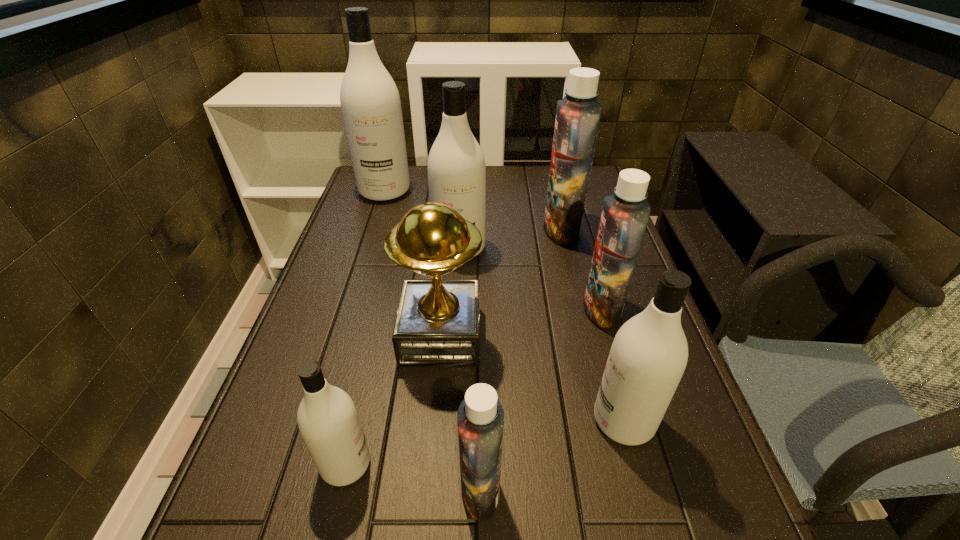
You are a GUI agent. You are given a task and a screenshot of the screen. Output one action in this format:
    pyautogui.click(x=<x>, y=<y>)
    Task: Click on the vacant space at the left edge of the desktop
    
    Given the screenshot: What is the action you would take?
    pyautogui.click(x=266, y=513)

Where is `free location at the right edge`? The image size is (960, 540). free location at the right edge is located at coordinates (660, 538).

Locate an element on the screen. vacant space at the far left corner of the desktop is located at coordinates [354, 197].

Locate an element on the screen. vacant space at the far right corner of the desktop is located at coordinates (590, 190).

Locate an element on the screen. free space between the nearest blue shampoo and the third nearest white shampoo is located at coordinates (470, 369).

This screenshot has height=540, width=960. Identify the location of free space between the second farthest blue shampoo and the farthest shampoo. (493, 250).

Locate an element on the screen. Image resolution: width=960 pixels, height=540 pixels. vacant area that lies between the second smallest white shampoo and the biggest blue shampoo is located at coordinates (592, 325).

You are a GUI agent. You are given a task and a screenshot of the screen. Output one action in this format:
    pyautogui.click(x=<x>, y=<y>)
    Task: Click on the vacant space in between the second smallest white shampoo and the third smallest white shampoo
    This screenshot has height=540, width=960.
    Given the screenshot: What is the action you would take?
    pyautogui.click(x=541, y=334)

You are a GUI agent. You are given a task and a screenshot of the screen. Output one action in this format:
    pyautogui.click(x=<x>, y=<y>)
    Task: Click on the vacant area between the rightmost white shampoo and the second white shampoo from right to left
    The height and width of the screenshot is (540, 960).
    Given the screenshot: What is the action you would take?
    pyautogui.click(x=541, y=334)

Find the location of a particular element. The width and height of the screenshot is (960, 540). vacant region between the award and the rightmost white shampoo is located at coordinates (532, 378).